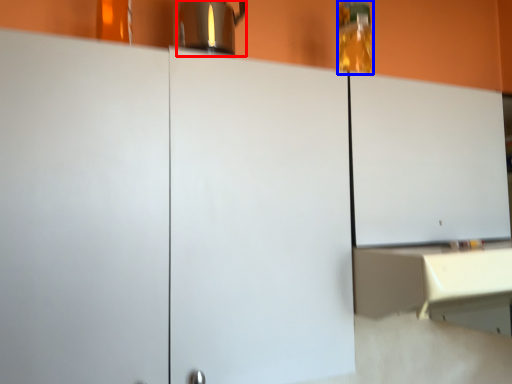
Question: Which object appears closest to the camera in this image, coffeepot (highlighted by a red box) or bottle (highlighted by a blue box)?

Choices:
 (A) coffeepot
 (B) bottle

Answer: (A)